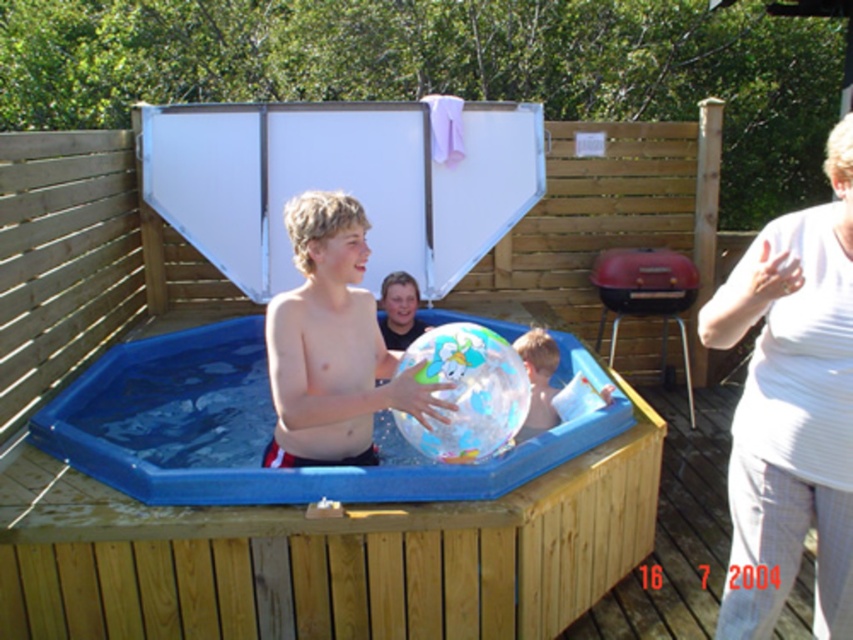
Question: In this image, where is white textured shirt at right located relative to transparent plastic beach ball at center?

Choices:
 (A) above
 (B) below

Answer: (A)

Question: Which object is farther from the camera taking this photo?

Choices:
 (A) white textured shirt at right
 (B) transparent plastic beach ball at center
 (C) smooth skin boy at center
 (D) transparent plastic pool at center

Answer: (D)

Question: Observing the image, what is the correct spatial positioning of smooth skin boy at center in reference to transparent plastic beach ball at center?

Choices:
 (A) below
 (B) above

Answer: (B)

Question: Which point is farther from the camera taking this photo?

Choices:
 (A) (315, 346)
 (B) (572, 371)
 (C) (828, 380)
 (D) (450, 460)

Answer: (B)

Question: Is white textured shirt at right to the right of smooth skin boy at center from the viewer's perspective?

Choices:
 (A) no
 (B) yes

Answer: (B)

Question: Considering the real-world distances, which object is closest to the transparent plastic pool at center?

Choices:
 (A) smooth skin boy at center
 (B) white textured shirt at right
 (C) transparent plastic beach ball at center

Answer: (C)